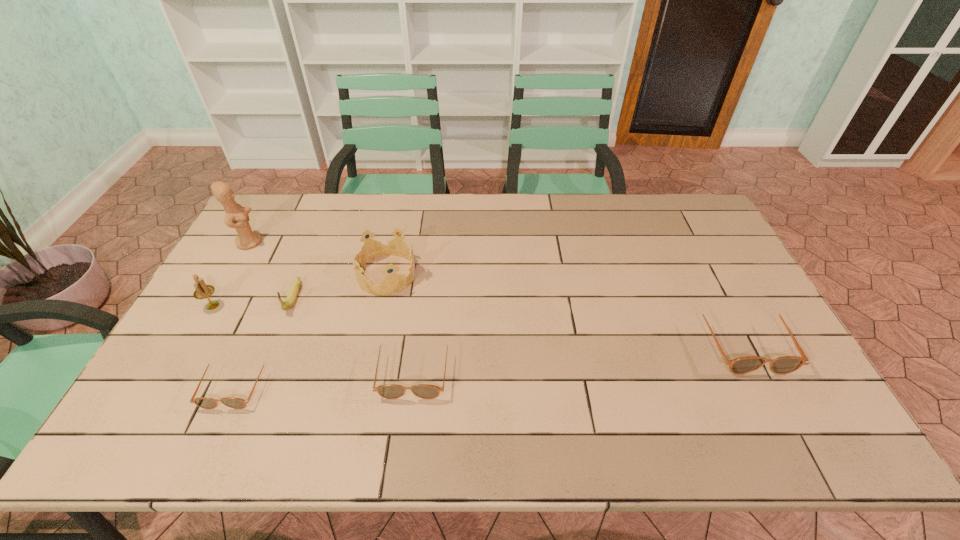
Please mark a free spot for a new sunglasses to balance the arrangement. Please provide its 2D coordinates. Your answer should be formatted as a tuple, i.e. [(x, y)], where the tuple contains the x and y coordinates of a point satisfying the conditions above.

[(583, 355)]